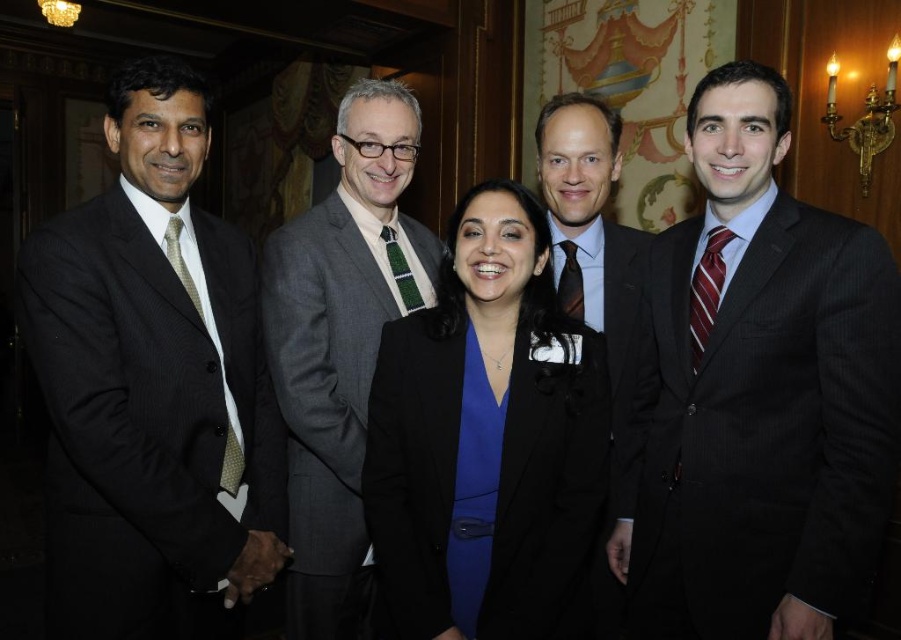
The image size is (901, 640). Identify the location of gray wool suit at center. (341, 348).

Can you confirm if gray wool suit at center is bigger than dark gray suit at center?

Correct, gray wool suit at center is larger in size than dark gray suit at center.

Is point (349, 348) positioned before point (611, 332)?

Yes.

I want to click on gray wool suit at center, so click(341, 348).

Which of these two, dark pinstripe suit at right or dark gray suit at center, stands taller?

dark gray suit at center is taller.

Which is in front, point (840, 532) or point (608, 342)?

Point (840, 532)

Is point (649, 339) closer to camera compared to point (606, 285)?

Yes.

Locate an element on the screen. This screenshot has height=640, width=901. dark pinstripe suit at right is located at coordinates (758, 392).

Is point (818, 339) closer to viewer compared to point (379, 541)?

Yes, it is in front of point (379, 541).

Is dark pinstripe suit at right to the left of black matte blazer at center from the viewer's perspective?

Incorrect, dark pinstripe suit at right is not on the left side of black matte blazer at center.

Which is in front, point (640, 422) or point (508, 266)?

Point (508, 266)

Locate an element on the screen. dark pinstripe suit at right is located at coordinates (758, 392).